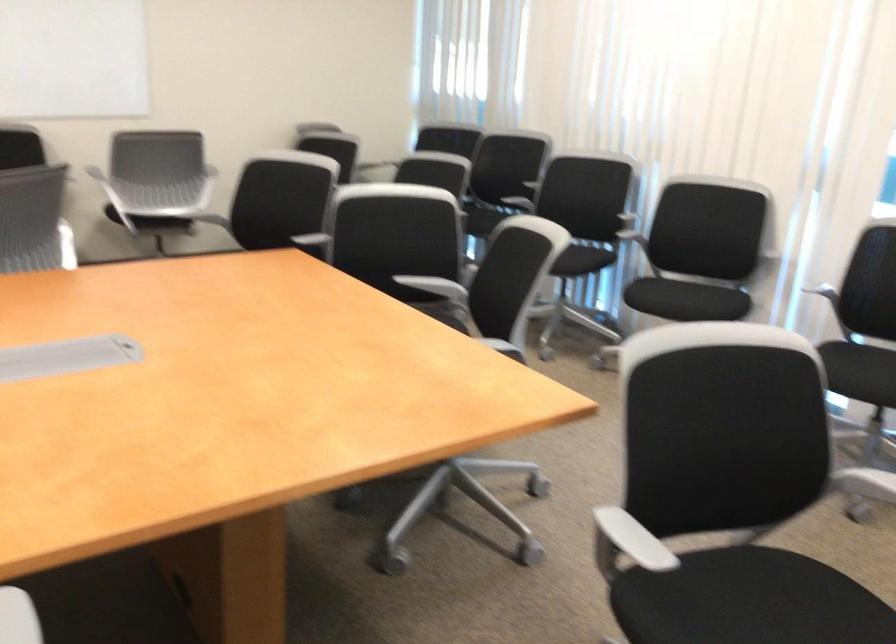
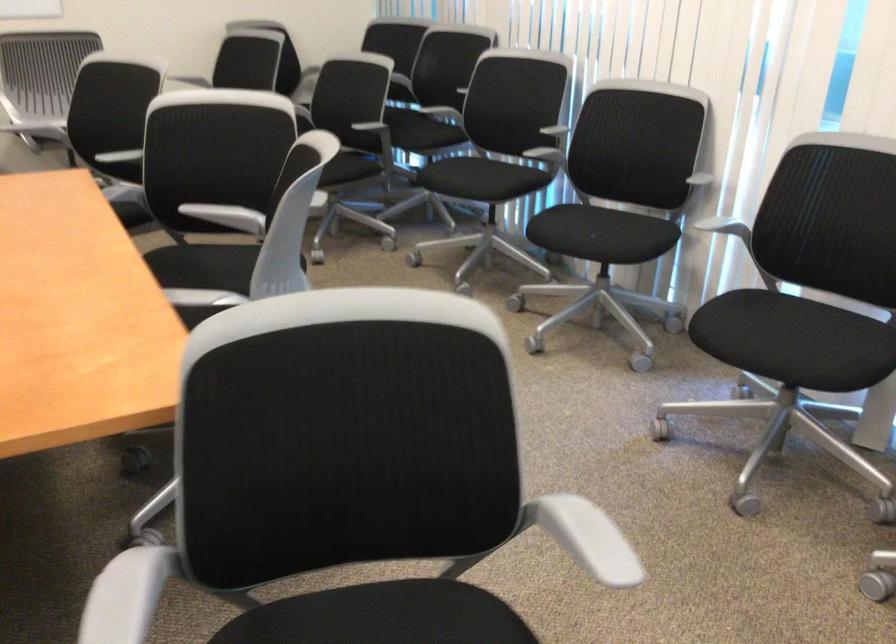
Which direction would the cameraman need to move to produce the second image?

The cameraman walked toward right, forward.